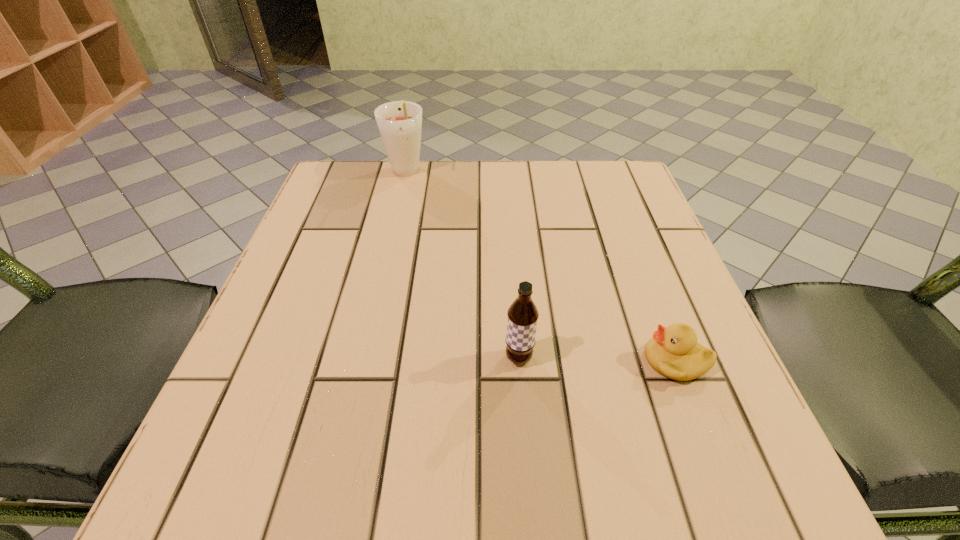
Locate an element on the screen. Image resolution: width=960 pixels, height=540 pixels. vacant space that's between the tallest object and the second object from right to left is located at coordinates (462, 266).

Locate an element on the screen. This screenshot has height=540, width=960. free point between the right root beer and the farthest object is located at coordinates (462, 266).

Identify the location of free point between the shorter root beer and the duckling. (597, 359).

Locate an element on the screen. Image resolution: width=960 pixels, height=540 pixels. free space between the left root beer and the right root beer is located at coordinates (462, 266).

Find the location of a particular element. The height and width of the screenshot is (540, 960). vacant point located between the duckling and the leftmost object is located at coordinates (x=540, y=267).

Locate an element on the screen. The width and height of the screenshot is (960, 540). free spot between the shortest object and the second object from right to left is located at coordinates (597, 359).

What are the coordinates of `free space between the left root beer and the right root beer` in the screenshot? It's located at (462, 266).

This screenshot has height=540, width=960. I want to click on vacant area that lies between the second object from left to right and the farther root beer, so click(x=462, y=266).

Where is `unoccupied position between the second shortest object and the shortest object`? unoccupied position between the second shortest object and the shortest object is located at coordinates (597, 359).

Where is `free space between the rightmost object and the left root beer`? Image resolution: width=960 pixels, height=540 pixels. free space between the rightmost object and the left root beer is located at coordinates (540, 267).